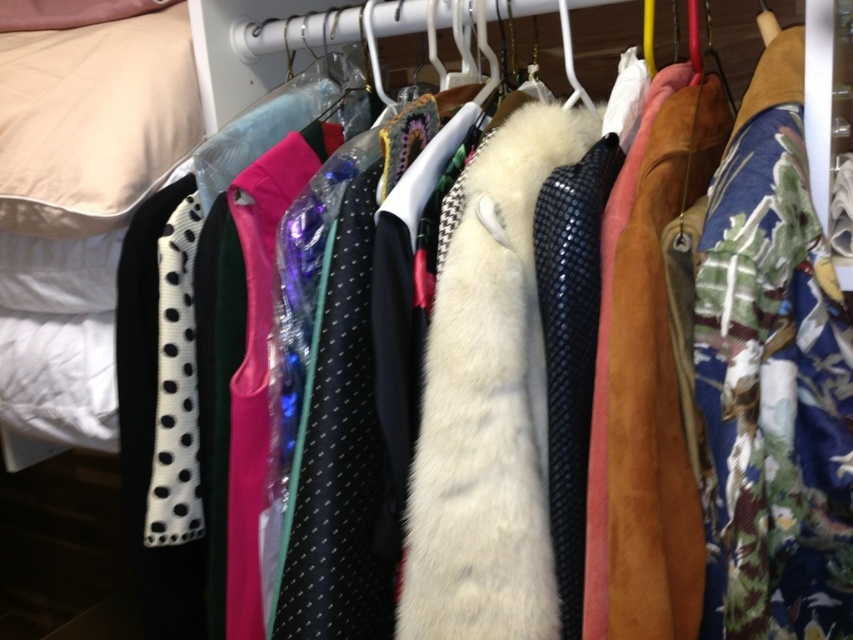
The image size is (853, 640). What do you see at coordinates (772, 380) in the screenshot? I see `floral fabric dress at right` at bounding box center [772, 380].

Does floral fabric dress at right have a greater height compared to black textured tie at center?

Yes.

Which is in front, point (767, 234) or point (576, 461)?

Positioned in front is point (767, 234).

Locate an element on the screen. The width and height of the screenshot is (853, 640). floral fabric dress at right is located at coordinates (772, 380).

Is floral fabric dress at right shorter than black dotted fabric tie at left?

Incorrect, floral fabric dress at right's height does not fall short of black dotted fabric tie at left's.

Which of these two, floral fabric dress at right or black dotted fabric tie at left, stands taller?

floral fabric dress at right

Where is `floral fabric dress at right`? This screenshot has width=853, height=640. floral fabric dress at right is located at coordinates (772, 380).

Is white fabric pillow at upper left to the right of black dotted fabric tie at center from the viewer's perspective?

Incorrect, white fabric pillow at upper left is not on the right side of black dotted fabric tie at center.

Between white fabric pillow at upper left and black dotted fabric tie at center, which one is positioned lower?

Positioned lower is black dotted fabric tie at center.

Identify the location of white fabric pillow at upper left. (91, 120).